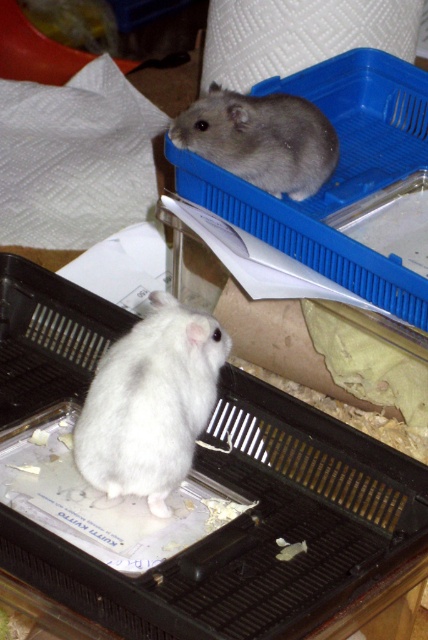
Question: Which point is closer to the camera taking this photo?

Choices:
 (A) (130, 428)
 (B) (255, 148)

Answer: (A)

Question: Which point is farther to the camera?

Choices:
 (A) (121, 410)
 (B) (190, 131)

Answer: (B)

Question: Which point is closer to the camera taking this photo?

Choices:
 (A) (190, 408)
 (B) (202, 125)

Answer: (A)

Question: Does white fluffy hamster at center appear under gray furry hamster at upper center?

Choices:
 (A) no
 (B) yes

Answer: (B)

Question: From the image, what is the correct spatial relationship of white fluffy hamster at center in relation to gray furry hamster at upper center?

Choices:
 (A) above
 (B) below

Answer: (B)

Question: Where is white fluffy hamster at center located in relation to gray furry hamster at upper center in the image?

Choices:
 (A) below
 (B) above

Answer: (A)